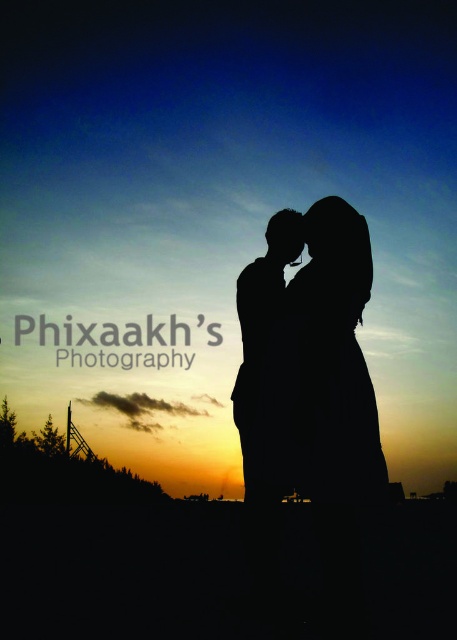
Is point (350, 401) closer to camera compared to point (249, 292)?

That is True.

Which is behind, point (312, 340) or point (256, 467)?

The point (256, 467) is behind.

Where is `silhouette couple at center`? This screenshot has width=457, height=640. silhouette couple at center is located at coordinates (324, 368).